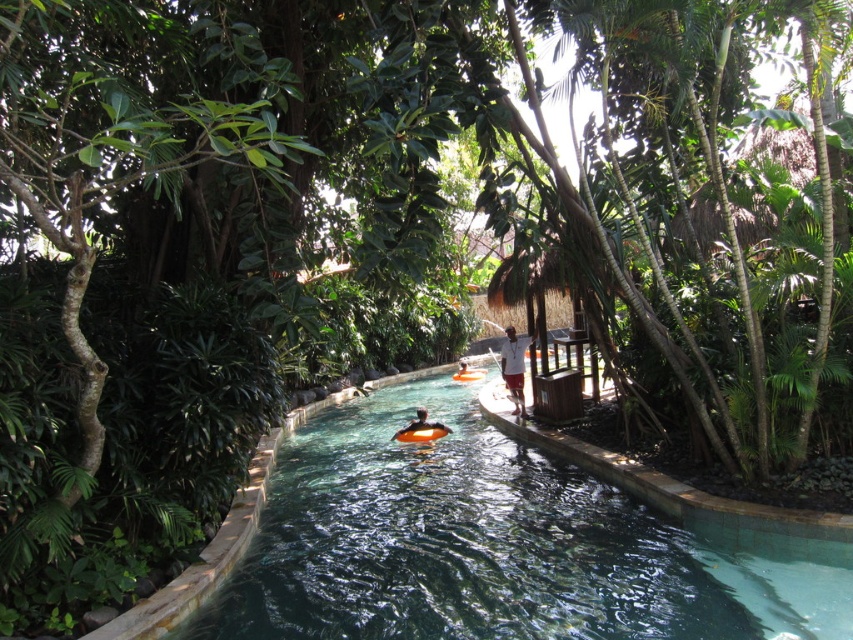
In the scene shown: You are a swimmer floating in the waterway and see the white matte shorts at center and the orange rubber ring at center. Which object is directly above the other?

The white matte shorts at center is positioned over the orange rubber ring at center, so the white matte shorts at center is directly above the orange rubber ring at center.

You are navigating a small boat along the waterway in the tropical setting. You see two points marked on your map at coordinates point (520, 394) and point (421, 422). Which point should you approach first if you want to follow the waterway in the direction it flows?

You should approach point (421, 422) first because point (520, 394) is behind it. Since the waterway flows in the direction from front to back, approaching the front point first aligns with the waterway flow direction.

Looking at this image, you are a swimmer at the center of the waterway. You see both the white matte shorts at center and the orange rubber ring at center. Which object is larger in size?

The white matte shorts at center is bigger than the orange rubber ring at center.